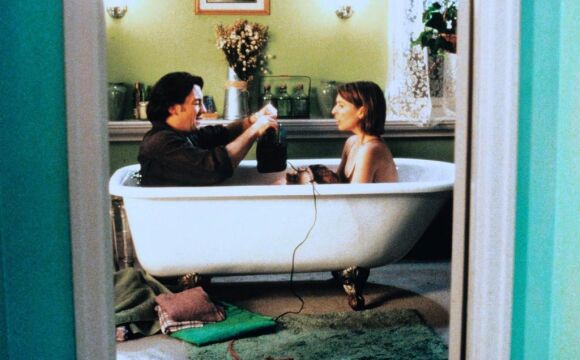
At what (x,y) coordinates should I click in order to perform the action: click on flowers on a counter top. Please return your answer as a coordinate pair (x, y). Looking at the image, I should click on (224, 37).